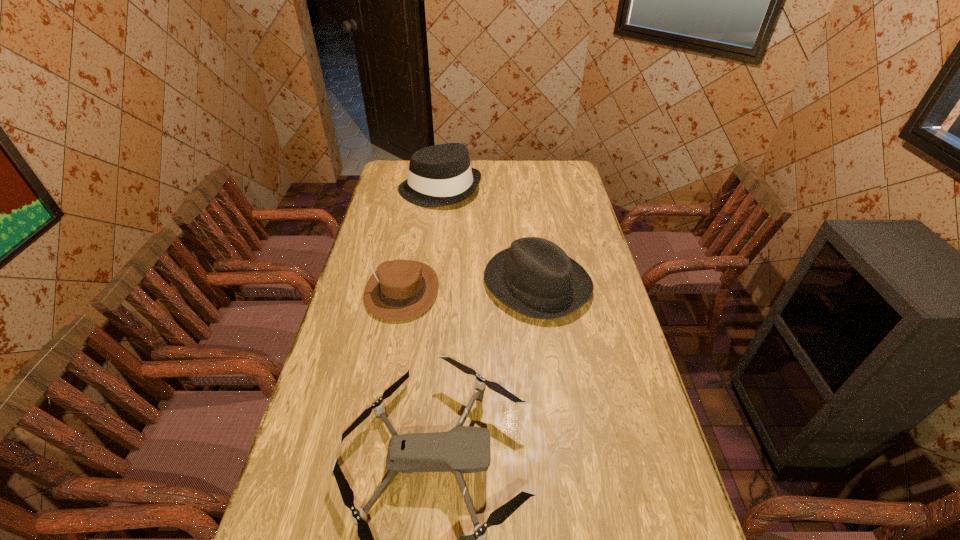
Image resolution: width=960 pixels, height=540 pixels. What are the coordinates of `free space at the far left corner of the desktop` in the screenshot? It's located at (398, 181).

The image size is (960, 540). What are the coordinates of `free spot at the far right corner of the desktop` in the screenshot? It's located at (573, 172).

Find the location of a particular element. object that ranks as the closest to the farthest fedora is located at coordinates pyautogui.click(x=535, y=277).

Identify which object is located as the third nearest to the shortest object. Please provide its 2D coordinates. Your answer should be formatted as a tuple, i.e. [(x, y)], where the tuple contains the x and y coordinates of a point satisfying the conditions above.

[(439, 175)]

Find the location of `the closest fedora to the rightmost fedora`. the closest fedora to the rightmost fedora is located at coordinates (399, 290).

Identify which fedora is the nearest to the shortest object. Please provide its 2D coordinates. Your answer should be formatted as a tuple, i.e. [(x, y)], where the tuple contains the x and y coordinates of a point satisfying the conditions above.

[(535, 277)]